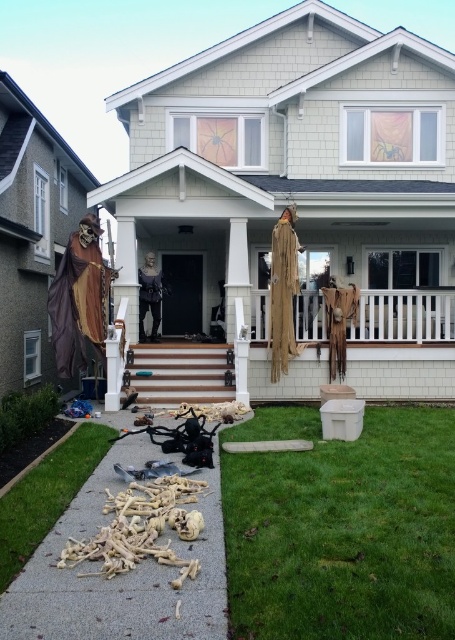
Question: Does green grass at lower center have a larger size compared to light brown wood at lower left?

Choices:
 (A) no
 (B) yes

Answer: (A)

Question: Which object is farther from the camera taking this photo?

Choices:
 (A) white striped wood stairs at center
 (B) light brown wood at lower left

Answer: (A)

Question: Is green grass at lower center closer to camera compared to white striped wood stairs at center?

Choices:
 (A) no
 (B) yes

Answer: (B)

Question: Which point is closer to the camera taking this photo?

Choices:
 (A) (178, 384)
 (B) (75, 490)

Answer: (B)

Question: Which point is closer to the camera taking this photo?

Choices:
 (A) (161, 396)
 (B) (75, 460)

Answer: (B)

Question: Considering the relative positions of light brown wood at lower left and white striped wood stairs at center in the image provided, where is light brown wood at lower left located with respect to white striped wood stairs at center?

Choices:
 (A) below
 (B) above

Answer: (A)